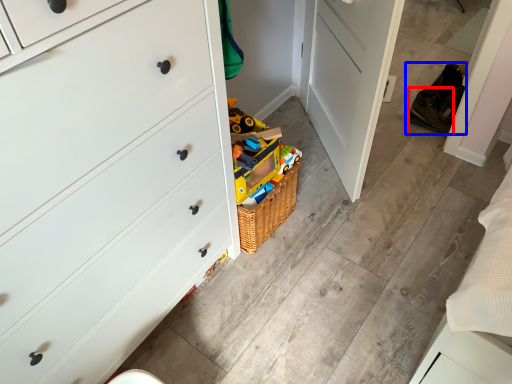
Question: Which object appears farthest to the camera in this image, shoe (highlighted by a red box) or shoe (highlighted by a blue box)?

Choices:
 (A) shoe
 (B) shoe

Answer: (B)